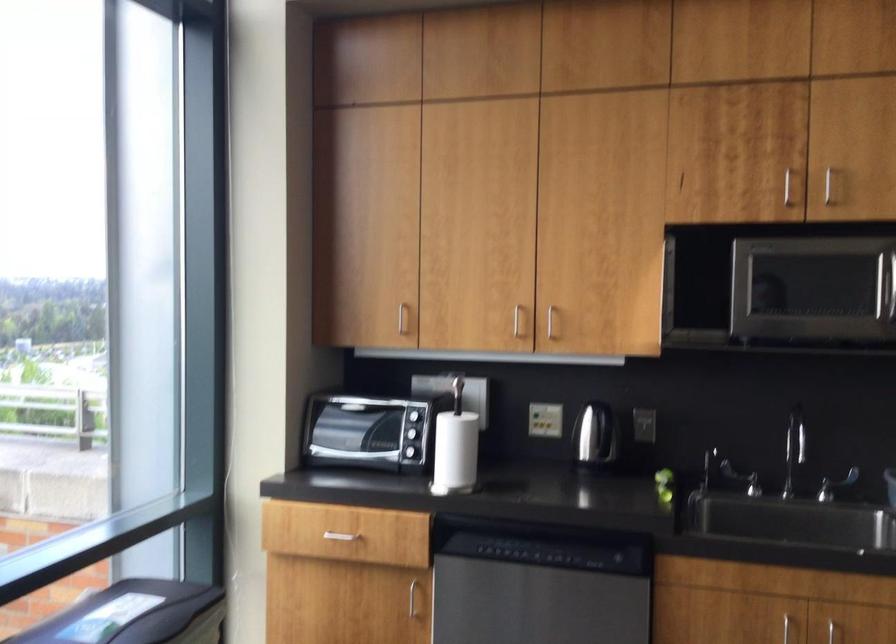
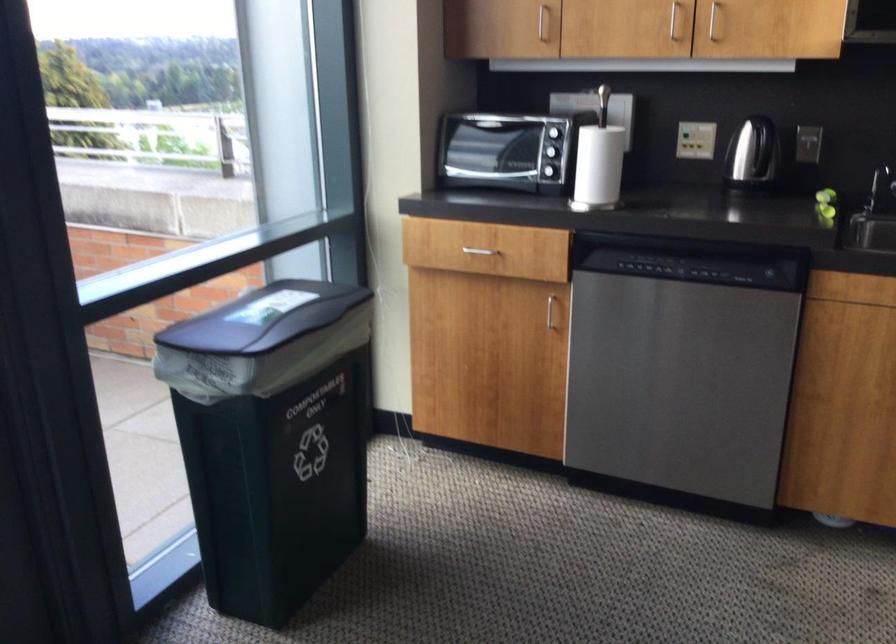
Find the pixel in the second image that matches (x=339, y=522) in the first image.

(474, 241)